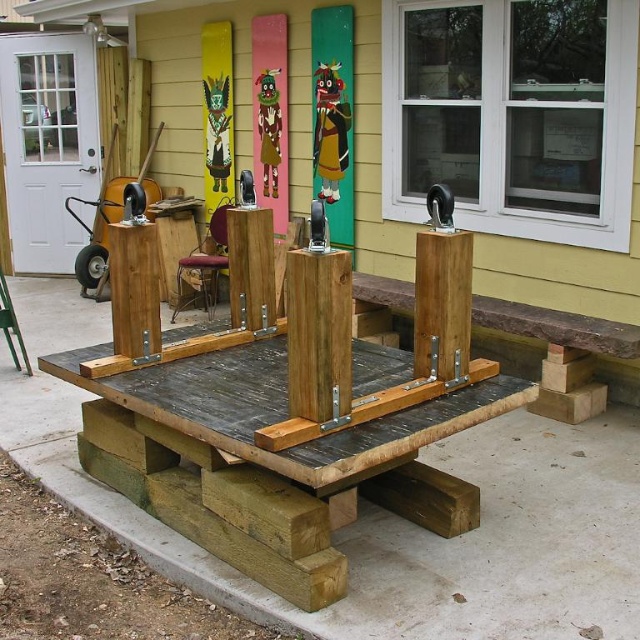
Is weathered wood bench at center bigger than brown wooden post at center?

Indeed, weathered wood bench at center has a larger size compared to brown wooden post at center.

Is the position of weathered wood bench at center less distant than that of brown wooden post at center?

That is False.

Between point (600, 330) and point (131, 344), which one is positioned behind?

Point (600, 330)

The image size is (640, 640). Find the location of `weathered wood bench at center`. weathered wood bench at center is located at coordinates (557, 326).

Does weathered wood bench at center have a greater height compared to velvet red stool at center?

In fact, weathered wood bench at center may be shorter than velvet red stool at center.

Is the position of weathered wood bench at center less distant than that of velvet red stool at center?

Yes, weathered wood bench at center is in front of velvet red stool at center.

Does point (532, 321) come in front of point (209, 269)?

Yes, point (532, 321) is closer to viewer.

Locate an element on the screen. This screenshot has width=640, height=640. weathered wood bench at center is located at coordinates (557, 326).

Does point (147, 296) come farther from viewer compared to point (198, 269)?

That is False.

Does brown wooden post at center appear on the right side of velvet red stool at center?

Yes, brown wooden post at center is to the right of velvet red stool at center.

Between point (132, 317) and point (204, 296), which one is positioned in front?

Positioned in front is point (132, 317).

This screenshot has width=640, height=640. I want to click on brown wooden post at center, so click(x=134, y=291).